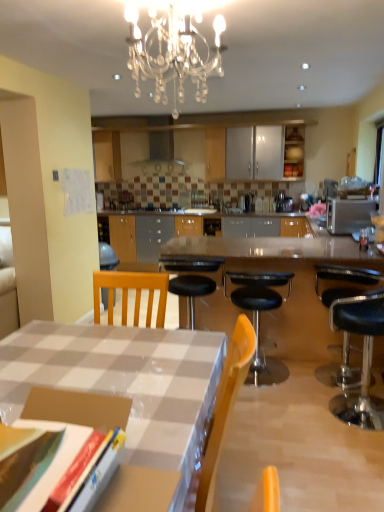
Measure the distance between black leather stool at center, the 1th chair from the left, and camera.

black leather stool at center, the 1th chair from the left, is 3.04 meters from camera.

This screenshot has height=512, width=384. Describe the element at coordinates (259, 315) in the screenshot. I see `black leather stool at center, acting as the second chair starting from the right` at that location.

I want to click on black leather stool at right, the 1th chair in the right-to-left sequence, so tap(343, 282).

The height and width of the screenshot is (512, 384). What do you see at coordinates (172, 54) in the screenshot?
I see `crystal glass chandelier at upper center` at bounding box center [172, 54].

This screenshot has width=384, height=512. What do you see at coordinates (293, 154) in the screenshot? I see `matte wood cabinet at upper center` at bounding box center [293, 154].

Find the location of a particular element. black leather stool at center, the 1th chair from the left is located at coordinates (259, 315).

Considering their positions, is silver metallic microwave at right located in front of or behind matte wood cabinet at upper center?

Visually, silver metallic microwave at right is located in front of matte wood cabinet at upper center.

Is silver metallic microwave at right far away from matte wood cabinet at upper center?

Absolutely, silver metallic microwave at right is distant from matte wood cabinet at upper center.

Does point (337, 213) come farther from viewer compared to point (294, 162)?

No, (337, 213) is closer to viewer.

Looking at this image, between matte wood cabinet at upper center and black leather stool at center, acting as the second chair starting from the right, which one is positioned in front?

Positioned in front is black leather stool at center, acting as the second chair starting from the right.

Between matte wood cabinet at upper center and black leather stool at center, acting as the second chair starting from the right, which one has larger size?

Bigger between the two is black leather stool at center, acting as the second chair starting from the right.

Starting from the matte wood cabinet at upper center, which chair is the 2nd one to the left? Please provide its 2D coordinates.

[(259, 315)]

Looking at this image, is crystal glass chandelier at upper center smaller than satin silver metallic exhaust hood at upper center?

Indeed, crystal glass chandelier at upper center has a smaller size compared to satin silver metallic exhaust hood at upper center.

Is crystal glass chandelier at upper center looking in the opposite direction of satin silver metallic exhaust hood at upper center?

No, crystal glass chandelier at upper center is not facing the opposite direction of satin silver metallic exhaust hood at upper center.

You are a GUI agent. You are given a task and a screenshot of the screen. Output one action in this format:
    pyautogui.click(x=<x>, y=<y>)
    Task: Click on the exhaust hood below the crystal glass chandelier at upper center (from a real-world perspective)
    
    Given the screenshot: What is the action you would take?
    pyautogui.click(x=161, y=156)

Looking at this image, can you tell me how much crystal glass chandelier at upper center and satin silver metallic exhaust hood at upper center differ in facing direction?

179 degrees.

Considering the positions of objects matte wood cabinet at upper center and silver metallic microwave at right in the image provided, who is more to the right, matte wood cabinet at upper center or silver metallic microwave at right?

silver metallic microwave at right is more to the right.

Between point (296, 133) and point (331, 216), which one is positioned in front?

The point (331, 216) is more forward.

Choose the correct answer: Is matte wood cabinet at upper center inside silver metallic microwave at right or outside it?

matte wood cabinet at upper center is outside silver metallic microwave at right.

Considering the positions of objects crystal glass chandelier at upper center and black leather stool at center, the 1th chair from the left, in the image provided, who is more to the left, crystal glass chandelier at upper center or black leather stool at center, the 1th chair from the left,?

crystal glass chandelier at upper center.

You are a GUI agent. You are given a task and a screenshot of the screen. Output one action in this format:
    pyautogui.click(x=<x>, y=<y>)
    Task: Click on the light fixture in front of the black leather stool at center, the 1th chair from the left
    The width and height of the screenshot is (384, 512).
    Given the screenshot: What is the action you would take?
    pyautogui.click(x=172, y=54)

Is crystal glass chandelier at upper center oriented towards black leather stool at center, the 1th chair from the left?

No, crystal glass chandelier at upper center is not facing towards black leather stool at center, the 1th chair from the left.

Which is behind, crystal glass chandelier at upper center or black leather stool at center, acting as the second chair starting from the right?

black leather stool at center, acting as the second chair starting from the right, is further from the camera.

Is point (166, 52) closer or farther from the camera than point (332, 214)?

Point (166, 52).

How much distance is there between crystal glass chandelier at upper center and silver metallic microwave at right?

The distance of crystal glass chandelier at upper center from silver metallic microwave at right is 6.66 feet.

Who is more distant, crystal glass chandelier at upper center or silver metallic microwave at right?

silver metallic microwave at right.

Is silver metallic microwave at right located within crystal glass chandelier at upper center?

A: No, crystal glass chandelier at upper center does not contain silver metallic microwave at right.

From a real-world perspective, is silver metallic microwave at right on black leather stool at center, the 1th chair from the left?

Yes, from a real-world perspective, silver metallic microwave at right is over black leather stool at center, the 1th chair from the left

Is silver metallic microwave at right far away from black leather stool at center, acting as the second chair starting from the right?

Yes, silver metallic microwave at right is far from black leather stool at center, acting as the second chair starting from the right.

Does silver metallic microwave at right have a larger size compared to black leather stool at center, the 1th chair from the left?

Answer: No, silver metallic microwave at right is not bigger than black leather stool at center, the 1th chair from the left.

This screenshot has width=384, height=512. I want to click on kitchen appliance lying on the right of matte wood cabinet at upper center, so click(348, 214).

At what (x,y) coordinates should I click in order to perform the action: click on the 2nd chair directly beneath the matte wood cabinet at upper center (from a real-world perspective). Please return your answer as a coordinate pair (x, y). Looking at the image, I should click on pyautogui.click(x=259, y=315).

Which object lies further to the anchor point black leather stool at center, the 1th chair from the left, silver metallic microwave at right or crystal glass chandelier at upper center?

The object further to black leather stool at center, the 1th chair from the left, is crystal glass chandelier at upper center.

Looking at the image, which one is located closer to satin silver metallic exhaust hood at upper center, polished granite table at center or matte wood cabinet at upper center?

matte wood cabinet at upper center is positioned closer to the anchor satin silver metallic exhaust hood at upper center.

Considering their positions, is silver metallic microwave at right positioned further to satin silver metallic exhaust hood at upper center than polished granite table at center?

The object further to satin silver metallic exhaust hood at upper center is polished granite table at center.

From the image, which object appears to be farther from polished granite table at center, black leather stool at right, the 2th chair in the left-to-right sequence, or crystal glass chandelier at upper center?

Based on the image, crystal glass chandelier at upper center appears to be further to polished granite table at center.

Based on their spatial positions, is black leather stool at center, acting as the second chair starting from the right, or silver metallic microwave at right further from black leather stool at right, the 1th chair in the right-to-left sequence?

The object further to black leather stool at right, the 1th chair in the right-to-left sequence, is silver metallic microwave at right.

From the image, which object appears to be farther from matte wood cabinet at upper center, crystal glass chandelier at upper center or black leather stool at right, the 1th chair in the right-to-left sequence?

Based on the image, crystal glass chandelier at upper center appears to be further to matte wood cabinet at upper center.

Looking at the image, which one is located closer to matte wood cabinet at upper center, black leather stool at right, the 1th chair in the right-to-left sequence, or polished granite table at center?

polished granite table at center is closer to matte wood cabinet at upper center.

When comparing their distances from black leather stool at right, the 1th chair in the right-to-left sequence, does silver metallic microwave at right or crystal glass chandelier at upper center seem closer?

The object closer to black leather stool at right, the 1th chair in the right-to-left sequence, is silver metallic microwave at right.

The width and height of the screenshot is (384, 512). I want to click on kitchen appliance located between white glossy desk at lower left and matte wood cabinet at upper center in the depth direction, so click(348, 214).

Locate an element on the screen. This screenshot has height=512, width=384. table between crystal glass chandelier at upper center and silver metallic microwave at right in the front-back direction is located at coordinates click(278, 271).

This screenshot has width=384, height=512. What are the coordinates of `table between white glossy desk at lower left and silver metallic microwave at right from front to back` in the screenshot? It's located at (278, 271).

I want to click on table located between black leather stool at center, the 1th chair from the left, and silver metallic microwave at right in the left-right direction, so click(x=278, y=271).